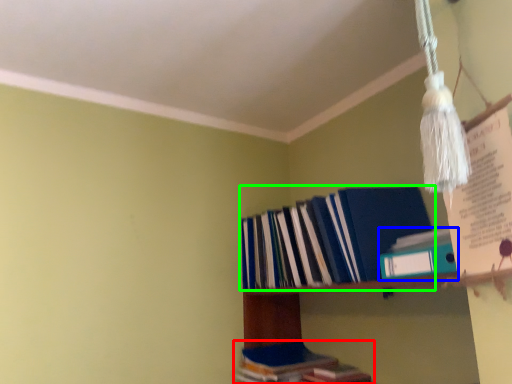
Question: Which object is positioned farthest from book (highlighted by a red box)? Select from book (highlighted by a blue box) and book (highlighted by a green box).

Choices:
 (A) book
 (B) book

Answer: (A)